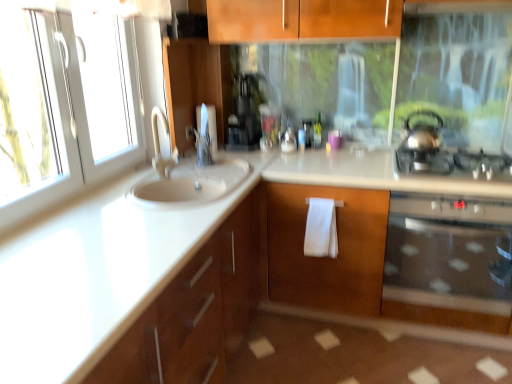
Image resolution: width=512 pixels, height=384 pixels. Find the location of `free space to the right of white glossy toilet paper at upper center`. free space to the right of white glossy toilet paper at upper center is located at coordinates (236, 151).